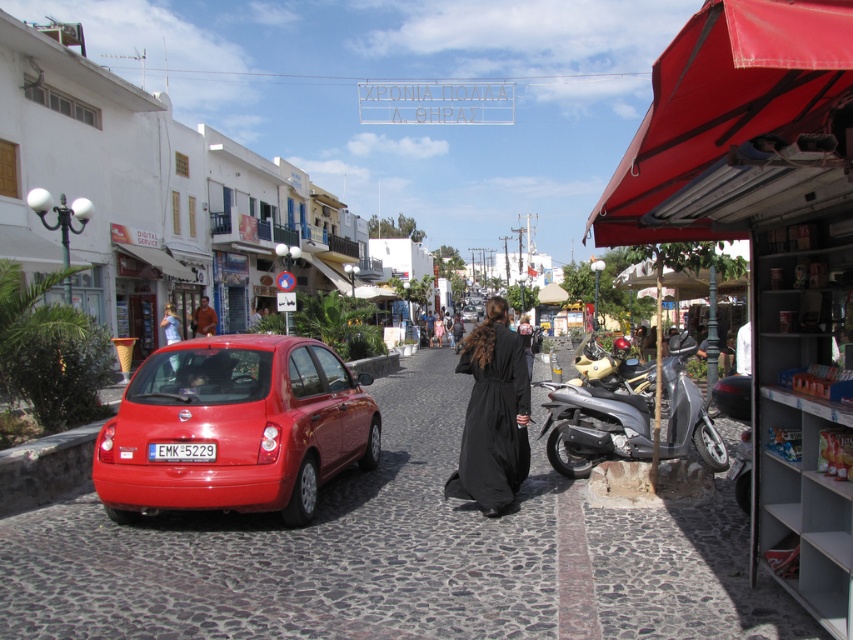
You are standing on the cobblestone street in the Mediterranean town and see the silver metallic scooter at right. If you were to draw a straight line from your current position to the scooter, what coordinates would you aim for?

The silver metallic scooter at right is located at coordinates 0.669 on the x axis and 0.698 on the y axis. So you should aim for the point at those coordinates.